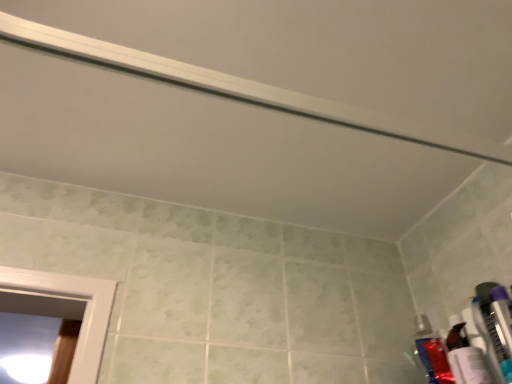
Question: Is purple plastic toothbrush at right, placed as the 1th toiletry when sorted from front to back, taller than translucent plastic toothbrush at lower right, which is counted as the third toiletry, starting from the back?

Choices:
 (A) no
 (B) yes

Answer: (A)

Question: Is purple plastic toothbrush at right, placed as the 1th toiletry when sorted from front to back, at the right side of translucent plastic toothbrush at lower right, which appears as the 2th toiletry when viewed from the front?

Choices:
 (A) yes
 (B) no

Answer: (A)

Question: Is purple plastic toothbrush at right, placed as the 1th toiletry when sorted from front to back, facing towards translucent plastic toothbrush at lower right, which appears as the 2th toiletry when viewed from the front?

Choices:
 (A) yes
 (B) no

Answer: (B)

Question: Considering the relative positions of purple plastic toothbrush at right, arranged as the fourth toiletry when viewed from the back, and translucent plastic toothbrush at lower right, which is counted as the third toiletry, starting from the back, in the image provided, is purple plastic toothbrush at right, arranged as the fourth toiletry when viewed from the back, to the left of translucent plastic toothbrush at lower right, which is counted as the third toiletry, starting from the back, from the viewer's perspective?

Choices:
 (A) yes
 (B) no

Answer: (B)

Question: Can you confirm if purple plastic toothbrush at right, placed as the 1th toiletry when sorted from front to back, is smaller than translucent plastic toothbrush at lower right, which appears as the 2th toiletry when viewed from the front?

Choices:
 (A) no
 (B) yes

Answer: (A)

Question: Is purple plastic toothbrush at right, arranged as the fourth toiletry when viewed from the back, closer to the viewer compared to translucent plastic toothbrush at lower right, which appears as the 2th toiletry when viewed from the front?

Choices:
 (A) no
 (B) yes

Answer: (B)

Question: Can you confirm if translucent plastic toothbrush at lower right, which is counted as the third toiletry, starting from the back, is smaller than translucent plastic toothpaste tube at lower right, acting as the 3th toiletry starting from the front?

Choices:
 (A) no
 (B) yes

Answer: (B)

Question: Considering the relative sizes of translucent plastic toothbrush at lower right, which appears as the 2th toiletry when viewed from the front, and translucent plastic toothpaste tube at lower right, which is counted as the 2th toiletry, starting from the back, in the image provided, is translucent plastic toothbrush at lower right, which appears as the 2th toiletry when viewed from the front, taller than translucent plastic toothpaste tube at lower right, which is counted as the 2th toiletry, starting from the back,?

Choices:
 (A) no
 (B) yes

Answer: (A)

Question: Is translucent plastic toothpaste tube at lower right, acting as the 3th toiletry starting from the front, surrounded by translucent plastic toothbrush at lower right, which appears as the 2th toiletry when viewed from the front?

Choices:
 (A) yes
 (B) no

Answer: (B)

Question: Is translucent plastic toothbrush at lower right, which appears as the 2th toiletry when viewed from the front, at the left side of translucent plastic toothpaste tube at lower right, which is counted as the 2th toiletry, starting from the back?

Choices:
 (A) yes
 (B) no

Answer: (B)

Question: Considering the relative sizes of translucent plastic toothbrush at lower right, which appears as the 2th toiletry when viewed from the front, and translucent plastic toothpaste tube at lower right, which is counted as the 2th toiletry, starting from the back, in the image provided, is translucent plastic toothbrush at lower right, which appears as the 2th toiletry when viewed from the front, wider than translucent plastic toothpaste tube at lower right, which is counted as the 2th toiletry, starting from the back,?

Choices:
 (A) no
 (B) yes

Answer: (A)

Question: Is translucent plastic toothbrush at lower right, which appears as the 2th toiletry when viewed from the front, aimed at translucent plastic toothpaste tube at lower right, which is counted as the 2th toiletry, starting from the back?

Choices:
 (A) no
 (B) yes

Answer: (A)

Question: Is translucent plastic toothbrush at lower right, which is counted as the third toiletry, starting from the back, positioned behind matte plastic toothpaste tube at right, the 1th toiletry viewed from the back?

Choices:
 (A) no
 (B) yes

Answer: (A)